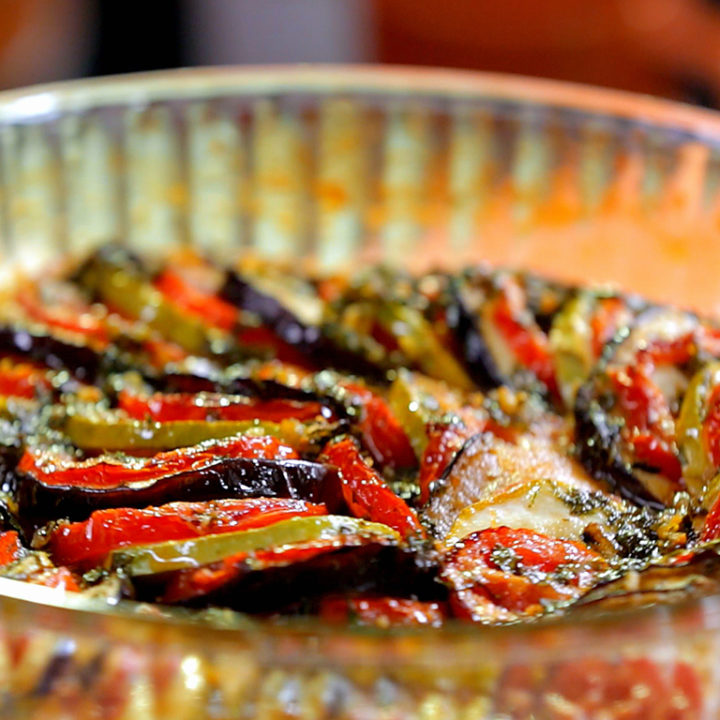
Locate an element on the screen. Image resolution: width=720 pixels, height=720 pixels. table is located at coordinates (567, 692).